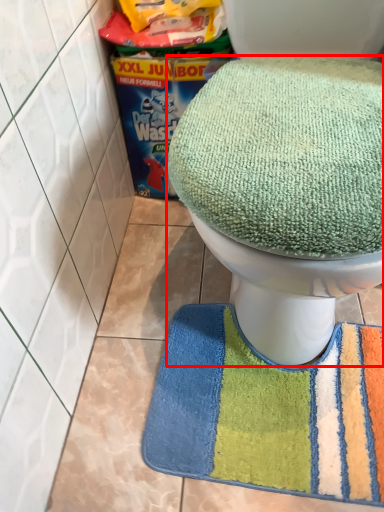
Question: From the image's perspective, where is toilet (annotated by the red box) located in relation to bath mat in the image?

Choices:
 (A) below
 (B) above

Answer: (B)